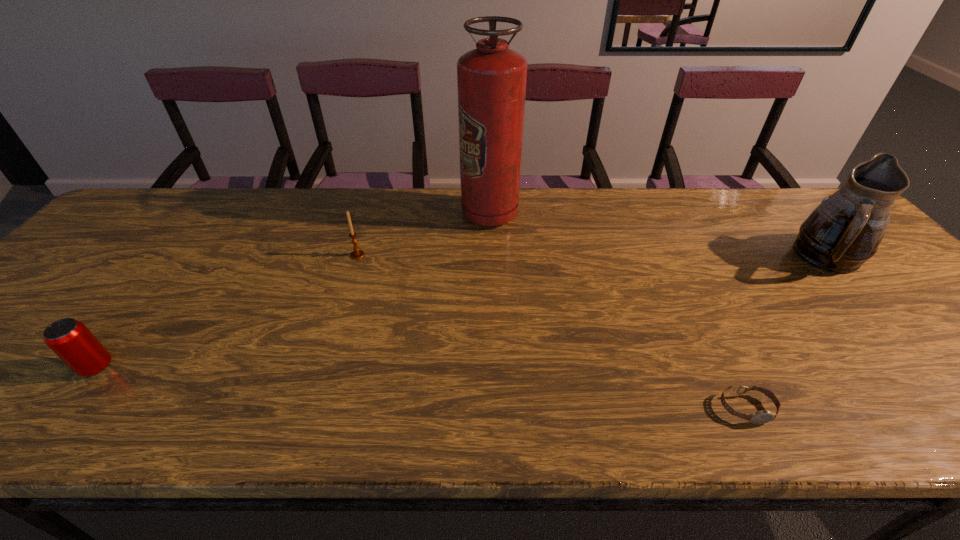
Identify the location of vacant region between the shortest object and the fire extinguisher. (618, 311).

Locate an element on the screen. Image resolution: width=960 pixels, height=540 pixels. free space between the leftmost object and the second object from left to right is located at coordinates point(228,311).

I want to click on vacant area between the shortest object and the leftmost object, so click(x=421, y=388).

Find the location of a particular element. object that is the fourth closest to the fourth farthest object is located at coordinates (844, 231).

Point out which object is positioned as the second nearest to the second object from left to right. Please provide its 2D coordinates. Your answer should be formatted as a tuple, i.e. [(x, y)], where the tuple contains the x and y coordinates of a point satisfying the conditions above.

[(69, 339)]